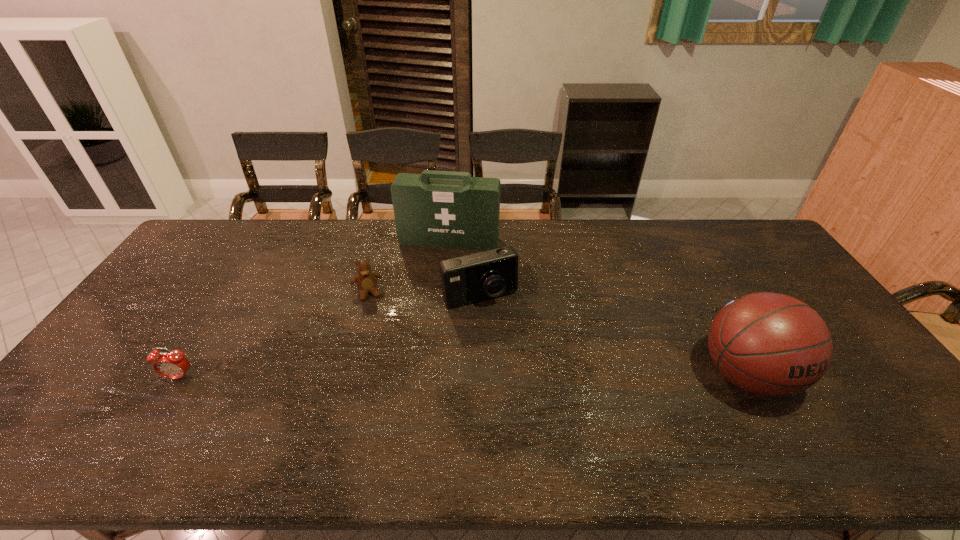
Image resolution: width=960 pixels, height=540 pixels. Find the location of `the second closest object to the farthest object`. the second closest object to the farthest object is located at coordinates (366, 280).

Where is `object that is the second nearest to the teddy bear`? The width and height of the screenshot is (960, 540). object that is the second nearest to the teddy bear is located at coordinates (475, 277).

Identify the location of free space that satisfies the following two spatial constraints: 1. on the front side of the camera; 2. on the right side of the first-aid kit. (444, 296).

The image size is (960, 540). Find the location of `vacant space that satisfies the following two spatial constraints: 1. on the front side of the third shortest object; 2. on the left side of the teddy bear`. vacant space that satisfies the following two spatial constraints: 1. on the front side of the third shortest object; 2. on the left side of the teddy bear is located at coordinates (367, 296).